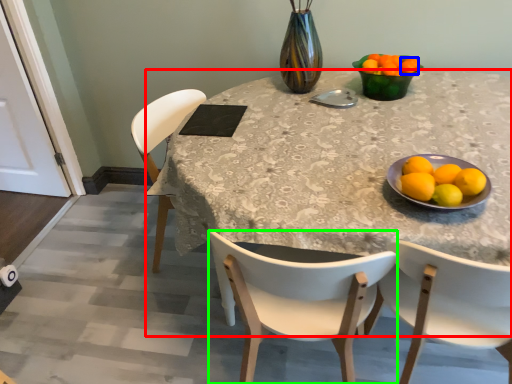
Question: Which object is positioned closest to desk (highlighted by a red box)? Select from tangerine (highlighted by a blue box) and chair (highlighted by a green box).

Choices:
 (A) tangerine
 (B) chair

Answer: (B)